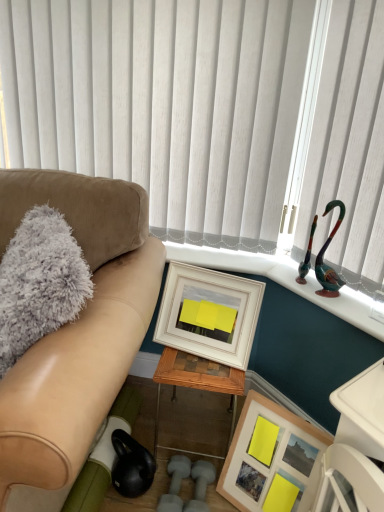
Question: From a real-world perspective, is woodenmaterial/texturetable at center over gray fluffy pillow at left?

Choices:
 (A) no
 (B) yes

Answer: (A)

Question: From the image's perspective, is woodenmaterial/texturetable at center below gray fluffy pillow at left?

Choices:
 (A) no
 (B) yes

Answer: (B)

Question: Can you confirm if woodenmaterial/texturetable at center is smaller than gray fluffy pillow at left?

Choices:
 (A) no
 (B) yes

Answer: (B)

Question: Is woodenmaterial/texturetable at center taller than gray fluffy pillow at left?

Choices:
 (A) yes
 (B) no

Answer: (B)

Question: Would you say woodenmaterial/texturetable at center contains gray fluffy pillow at left?

Choices:
 (A) yes
 (B) no

Answer: (B)

Question: Considering the positions of white vertical blinds at upper center and suede couch at left in the image, is white vertical blinds at upper center taller or shorter than suede couch at left?

Choices:
 (A) tall
 (B) short

Answer: (B)

Question: Relative to suede couch at left, is white vertical blinds at upper center in front or behind?

Choices:
 (A) behind
 (B) front

Answer: (A)

Question: From a real-world perspective, is white vertical blinds at upper center positioned above or below suede couch at left?

Choices:
 (A) above
 (B) below

Answer: (A)

Question: From the image's perspective, is white vertical blinds at upper center located above or below suede couch at left?

Choices:
 (A) below
 (B) above

Answer: (B)

Question: From their relative heights in the image, would you say woodenmaterial/texturetable at center is taller or shorter than matte white picture frame at center, which appears as the second picture frame when ordered from the bottom?

Choices:
 (A) short
 (B) tall

Answer: (B)

Question: Relative to matte white picture frame at center, which appears as the second picture frame when ordered from the bottom, is woodenmaterial/texturetable at center in front or behind?

Choices:
 (A) behind
 (B) front

Answer: (A)

Question: Based on their positions, is woodenmaterial/texturetable at center located to the left or right of matte white picture frame at center, which is the first picture frame in top-to-bottom order?

Choices:
 (A) left
 (B) right

Answer: (A)

Question: Which is correct: woodenmaterial/texturetable at center is inside matte white picture frame at center, which appears as the second picture frame when ordered from the bottom, or outside of it?

Choices:
 (A) outside
 (B) inside

Answer: (A)

Question: From their relative heights in the image, would you say wooden framed picture at lower right, the 1th picture frame from the bottom, is taller or shorter than shiny green glass swan at upper right?

Choices:
 (A) tall
 (B) short

Answer: (A)

Question: From the image's perspective, relative to shiny green glass swan at upper right, is wooden framed picture at lower right, the 1th picture frame from the bottom, above or below?

Choices:
 (A) below
 (B) above

Answer: (A)